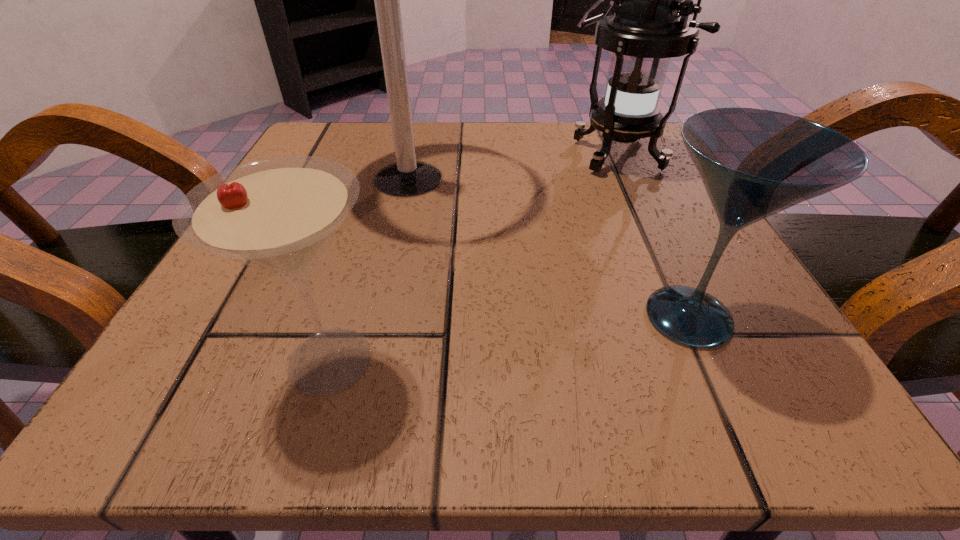
Identify the location of vacant space at the left edge. This screenshot has height=540, width=960. (331, 268).

Find the location of a particular element. Image resolution: width=960 pixels, height=540 pixels. vacant region at the right edge of the desktop is located at coordinates (681, 345).

You are a GUI agent. You are given a task and a screenshot of the screen. Output one action in this format:
    pyautogui.click(x=<x>, y=<y>)
    Task: Click on the free point at the near left corner
    
    Given the screenshot: What is the action you would take?
    pyautogui.click(x=197, y=413)

In order to click on vacant space at the near right corner of the desktop in this screenshot , I will do `click(668, 363)`.

The height and width of the screenshot is (540, 960). In order to click on free spot between the third shortest object and the left martini in this screenshot , I will do `click(470, 257)`.

At what (x,y) coordinates should I click in order to perform the action: click on empty location between the table lamp and the third shortest object. Please return your answer as a coordinate pair (x, y). Image resolution: width=960 pixels, height=540 pixels. Looking at the image, I should click on (510, 166).

The image size is (960, 540). What are the coordinates of `empty location between the tallest object and the lantern` in the screenshot? It's located at point(510,166).

Find the location of a particular element. free space between the table lamp and the lantern is located at coordinates (510, 166).

You are a GUI agent. You are given a task and a screenshot of the screen. Output one action in this format:
    pyautogui.click(x=<x>, y=<y>)
    Task: Click on the vacant area that lies between the right martini and the tallest object
    
    Given the screenshot: What is the action you would take?
    pyautogui.click(x=548, y=248)

The height and width of the screenshot is (540, 960). I want to click on empty location between the left martini and the lantern, so click(470, 257).